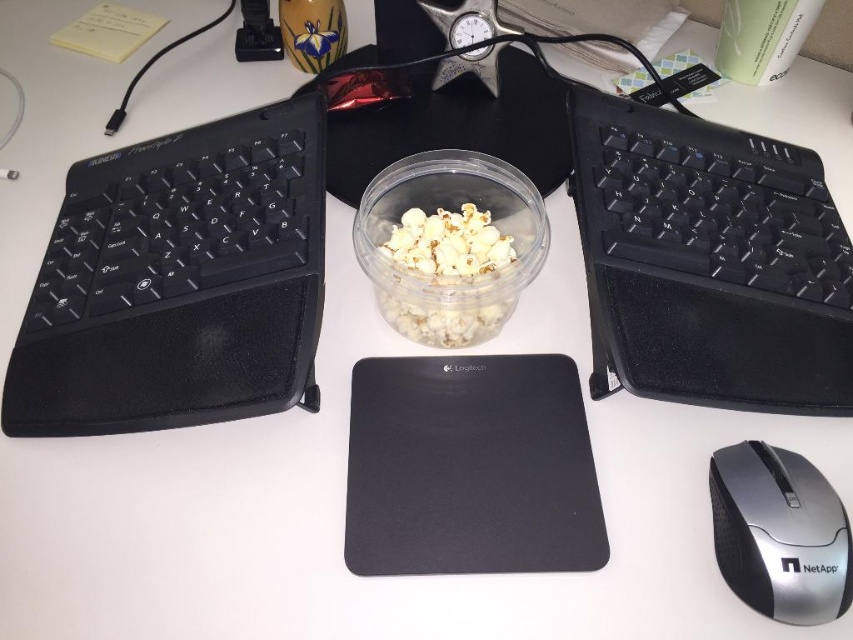
What do you see at coordinates (178, 282) in the screenshot? I see `black textured keyboard at left` at bounding box center [178, 282].

Does black textured keyboard at left lie behind silver/black plastic mouse at lower right?

That is True.

Is point (33, 305) positioned before point (828, 586)?

No, it is behind (828, 586).

Image resolution: width=853 pixels, height=640 pixels. In order to click on black textured keyboard at left in this screenshot , I will do `click(178, 282)`.

Which of these two, black textured keyboard at left or white matte popcorn at center, stands taller?

With more height is black textured keyboard at left.

Which of these two, black textured keyboard at left or white matte popcorn at center, stands shorter?

Standing shorter between the two is white matte popcorn at center.

I want to click on black textured keyboard at left, so click(x=178, y=282).

Is point (36, 374) positioned before point (816, 195)?

That is True.

Who is more forward, (x=200, y=387) or (x=718, y=304)?

Point (x=200, y=387) is in front.

Image resolution: width=853 pixels, height=640 pixels. Find the location of `black textured keyboard at left`. black textured keyboard at left is located at coordinates (178, 282).